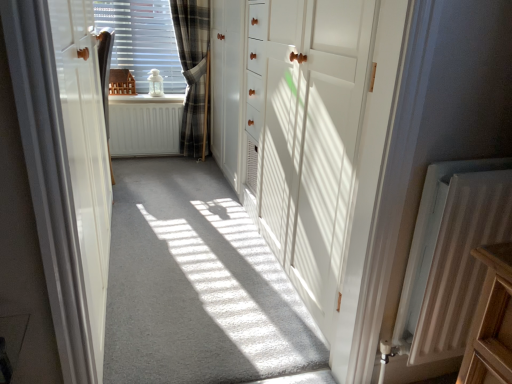
Identify the location of vacant area that is in front of white matte radiator at center, the 2th radiator in the right-to-left sequence. (150, 172).